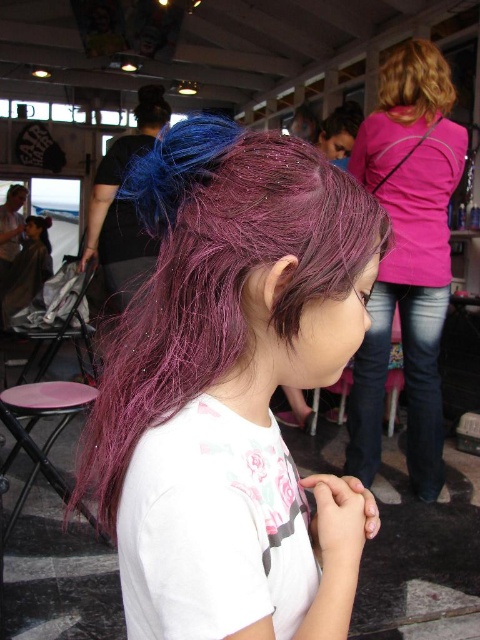
Consider the image. You are a photographer setting up a shoot in this scene. You need to position a spotlight to highlight both the shiny purple hair at center and the pink fabric shirt at upper right. Based on their positions, which object should be placed closer to the camera to ensure both are well lit without moving the spotlight?

The pink fabric shirt at upper right should be placed closer to the camera because the shiny purple hair at center is below it, so adjusting the shirt forward would allow the spotlight to cover both effectively.

You are a photographer setting up a shoot in this scene. You need to position a spotlight so it illuminates both the shiny purple hair at center and the blonde curly hair at upper right. Based on their positions, which hair should you aim the spotlight at first to ensure both are lit?

You should aim the spotlight at the shiny purple hair at center first because it is located below the blonde curly hair at upper right, so adjusting the light from the lower position will help illuminate both effectively.

In the image, there is a shiny purple hair at center and a blonde curly hair at upper right. Which one is positioned more to the left side?

The shiny purple hair at center is positioned more to the left side than the blonde curly hair at upper right.